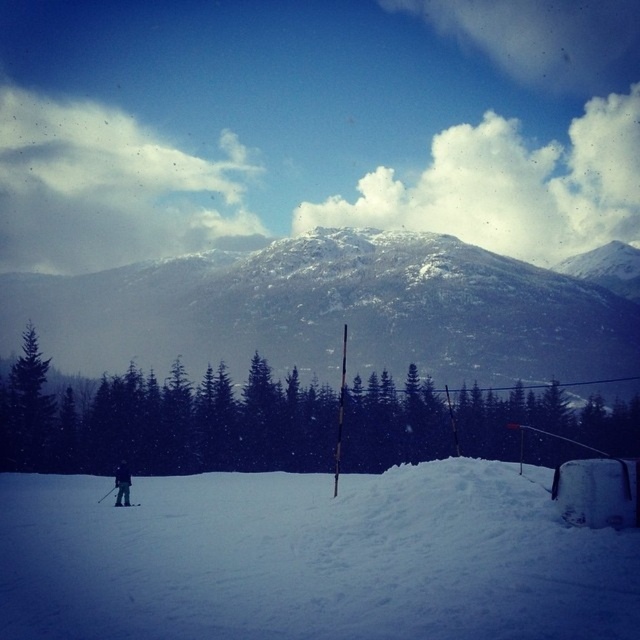
Question: Estimate the real-world distances between objects in this image. Which object is closer to the black matte ski at lower left?

Choices:
 (A) dark blue ski suit at lower left
 (B) green matte tree at center

Answer: (A)

Question: Estimate the real-world distances between objects in this image. Which object is farther from the green matte tree at center?

Choices:
 (A) dark blue ski suit at lower left
 (B) snowy rocky mountain at center
 (C) white powdery snow at lower left
 (D) green matte tree at left

Answer: (C)

Question: Can you confirm if white powdery snow at lower left is wider than dark blue ski suit at lower left?

Choices:
 (A) yes
 (B) no

Answer: (A)

Question: Does green matte tree at left have a lesser width compared to dark blue ski suit at lower left?

Choices:
 (A) no
 (B) yes

Answer: (B)

Question: Which object is the farthest from the green matte tree at left?

Choices:
 (A) snowy rocky mountain at center
 (B) black matte ski at lower left

Answer: (A)

Question: Is dark blue ski suit at lower left to the left of black matte ski at lower left from the viewer's perspective?

Choices:
 (A) yes
 (B) no

Answer: (A)